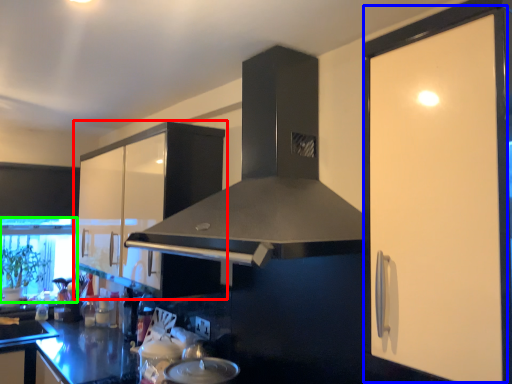
Question: Which is nearer to the cabinetry (highlighted by a red box)? screen door (highlighted by a blue box) or window screen (highlighted by a green box).

Choices:
 (A) screen door
 (B) window screen

Answer: (B)